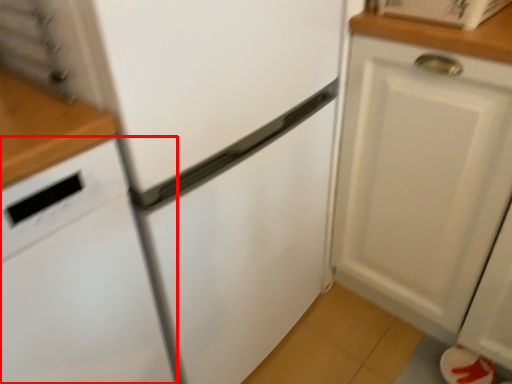
Question: In this image, where is dish washer (annotated by the red box) located relative to cabinetry?

Choices:
 (A) right
 (B) left

Answer: (B)